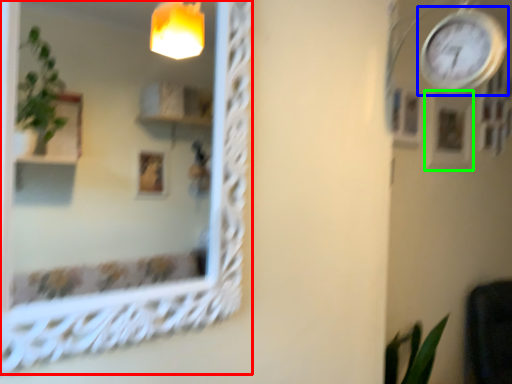
Question: Which object is positioned farthest from mirror (highlighted by a red box)? Select from clock (highlighted by a blue box) and picture frame (highlighted by a green box).

Choices:
 (A) clock
 (B) picture frame

Answer: (B)